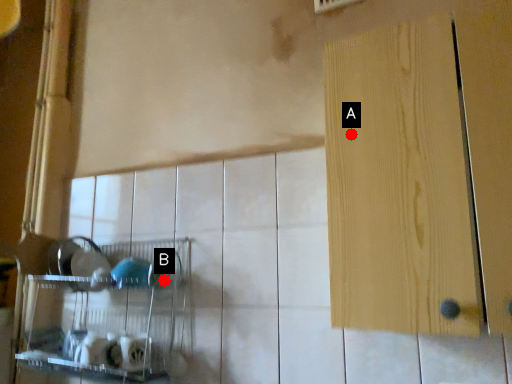
Question: Two points are circled on the image, labeled by A and B beside each circle. Among these points, which one is farthest from the camera?

Choices:
 (A) A is further
 (B) B is further

Answer: (B)